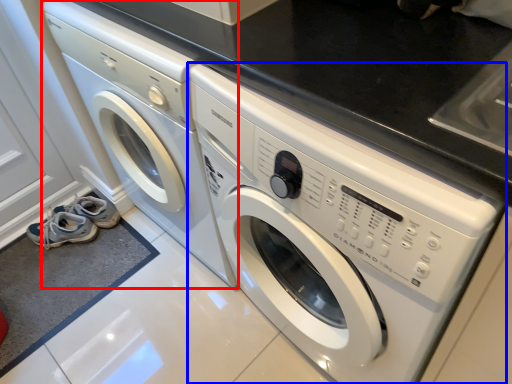
Question: Which object is further to the camera taking this photo, washing machine (highlighted by a red box) or washing machine (highlighted by a blue box)?

Choices:
 (A) washing machine
 (B) washing machine

Answer: (A)